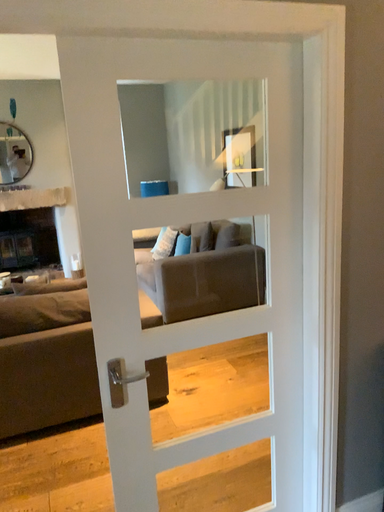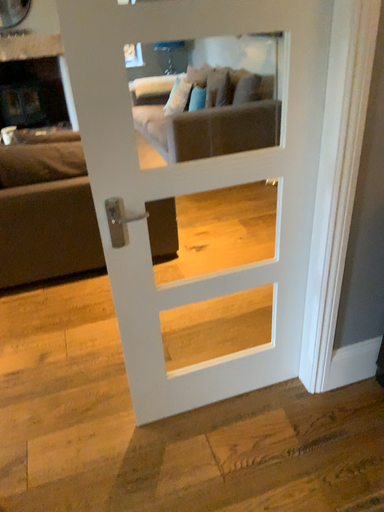
Question: Which way did the camera rotate in the video?

Choices:
 (A) rotated upward
 (B) rotated downward

Answer: (B)